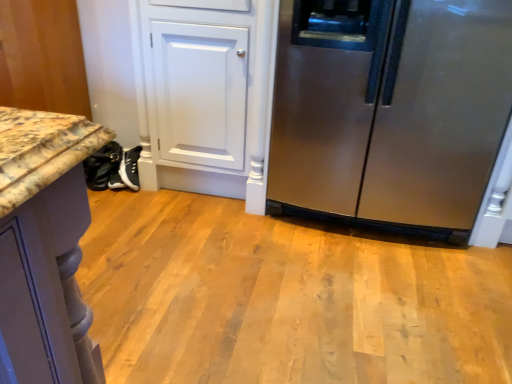
Question: Is marble countertop at lower left directly adjacent to black leather shoes at lower left?

Choices:
 (A) no
 (B) yes

Answer: (A)

Question: From a real-world perspective, is marble countertop at lower left on top of black leather shoes at lower left?

Choices:
 (A) no
 (B) yes

Answer: (B)

Question: Is black leather shoes at lower left a part of marble countertop at lower left?

Choices:
 (A) yes
 (B) no

Answer: (B)

Question: Does marble countertop at lower left have a lesser width compared to black leather shoes at lower left?

Choices:
 (A) yes
 (B) no

Answer: (B)

Question: Would you consider marble countertop at lower left to be distant from black leather shoes at lower left?

Choices:
 (A) yes
 (B) no

Answer: (B)

Question: Based on their positions, is marble countertop at lower left located to the left or right of black leather shoes at lower left?

Choices:
 (A) right
 (B) left

Answer: (B)

Question: Based on their sizes in the image, would you say marble countertop at lower left is bigger or smaller than black leather shoes at lower left?

Choices:
 (A) small
 (B) big

Answer: (B)

Question: Which is correct: marble countertop at lower left is inside black leather shoes at lower left, or outside of it?

Choices:
 (A) inside
 (B) outside

Answer: (B)

Question: Is marble countertop at lower left wider or thinner than black leather shoes at lower left?

Choices:
 (A) thin
 (B) wide

Answer: (B)

Question: In the image, is stainless steel refrigerator at right on the left side or the right side of marble countertop at lower left?

Choices:
 (A) right
 (B) left

Answer: (A)

Question: From the image's perspective, relative to marble countertop at lower left, is stainless steel refrigerator at right above or below?

Choices:
 (A) above
 (B) below

Answer: (B)

Question: Does point (407, 205) appear closer or farther from the camera than point (0, 97)?

Choices:
 (A) farther
 (B) closer

Answer: (B)

Question: Is stainless steel refrigerator at right inside the boundaries of marble countertop at lower left, or outside?

Choices:
 (A) inside
 (B) outside

Answer: (B)

Question: Is black leather shoes at lower left wider or thinner than stainless steel refrigerator at right?

Choices:
 (A) wide
 (B) thin

Answer: (B)

Question: From a real-world perspective, is black leather shoes at lower left above or below stainless steel refrigerator at right?

Choices:
 (A) above
 (B) below

Answer: (B)